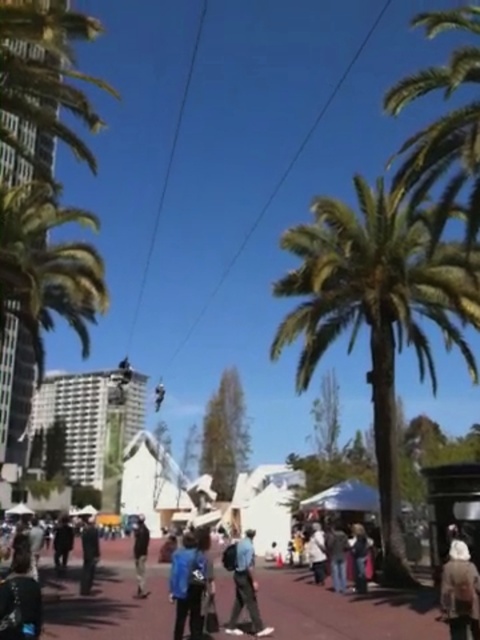
Between point (164, 570) and point (339, 572), which one is positioned in front?

Point (339, 572)

Is point (369, 600) positioned before point (336, 545)?

That is True.

Is point (334, 627) farther from viewer compared to point (333, 548)?

No, it is not.

Identify the location of paved asphalt at center. (344, 611).

Who is positioned more to the right, dark blue jeans at center or light blue denim jacket at center?

light blue denim jacket at center is more to the right.

Does dark blue jeans at center appear over light blue denim jacket at center?

Actually, dark blue jeans at center is below light blue denim jacket at center.

What do you see at coordinates (141, 556) in the screenshot?
I see `dark blue jeans at center` at bounding box center [141, 556].

The width and height of the screenshot is (480, 640). Identify the location of dark blue jeans at center. (141, 556).

Which of these two, blue fabric jacket at center or dark blue jeans at center, stands taller?

dark blue jeans at center

Does blue fabric jacket at center have a greater height compared to dark blue jeans at center?

No.

What do you see at coordinates (189, 584) in the screenshot? I see `blue fabric jacket at center` at bounding box center [189, 584].

At what (x,y) coordinates should I click in order to perform the action: click on blue fabric jacket at center. Please return your answer as a coordinate pair (x, y). The height and width of the screenshot is (640, 480). Looking at the image, I should click on (189, 584).